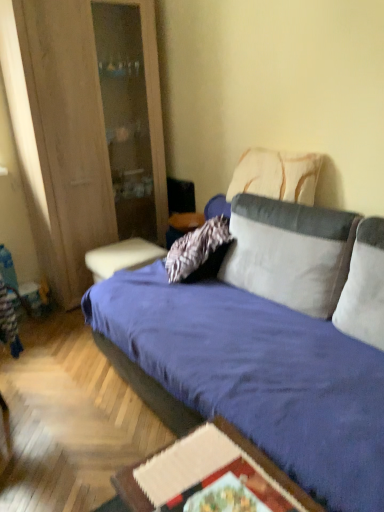
Question: Should I look upward or downward to see velvety white pillow at center, acting as the second pillow starting from the back?

Choices:
 (A) up
 (B) down

Answer: (A)

Question: Does white textured pillow at upper right, the 1th pillow viewed from the back, have a greater height compared to velvet blue studio couch at center?

Choices:
 (A) yes
 (B) no

Answer: (B)

Question: Can you confirm if white textured pillow at upper right, the 1th pillow viewed from the back, is positioned to the right of velvet blue studio couch at center?

Choices:
 (A) no
 (B) yes

Answer: (B)

Question: From the image's perspective, would you say white textured pillow at upper right, which ranks as the third pillow in front-to-back order, is positioned over velvet blue studio couch at center?

Choices:
 (A) no
 (B) yes

Answer: (B)

Question: Is velvet blue studio couch at center completely or partially inside white textured pillow at upper right, which ranks as the third pillow in front-to-back order?

Choices:
 (A) no
 (B) yes

Answer: (A)

Question: Can you confirm if white textured pillow at upper right, the 1th pillow viewed from the back, is thinner than velvet blue studio couch at center?

Choices:
 (A) yes
 (B) no

Answer: (A)

Question: Is white textured pillow at upper right, which ranks as the third pillow in front-to-back order, turned away from velvet blue studio couch at center?

Choices:
 (A) yes
 (B) no

Answer: (B)

Question: Does white soft pillow at right, the 3th pillow positioned from the back, turn towards velvet blue studio couch at center?

Choices:
 (A) no
 (B) yes

Answer: (B)

Question: From the image's perspective, would you say white soft pillow at right, which is the first pillow from front to back, is shown under velvet blue studio couch at center?

Choices:
 (A) no
 (B) yes

Answer: (A)

Question: Is white soft pillow at right, the 3th pillow positioned from the back, shorter than velvet blue studio couch at center?

Choices:
 (A) no
 (B) yes

Answer: (B)

Question: Does white soft pillow at right, the 3th pillow positioned from the back, appear on the left side of velvet blue studio couch at center?

Choices:
 (A) no
 (B) yes

Answer: (A)

Question: From a real-world perspective, is white soft pillow at right, which is the first pillow from front to back, located beneath velvet blue studio couch at center?

Choices:
 (A) yes
 (B) no

Answer: (B)

Question: Is white soft pillow at right, which is the first pillow from front to back, not inside velvet blue studio couch at center?

Choices:
 (A) no
 (B) yes

Answer: (A)

Question: Is matte blue table at center, which ranks as the first table in back-to-front order, smaller than white soft pillow at right, which is the first pillow from front to back?

Choices:
 (A) yes
 (B) no

Answer: (B)